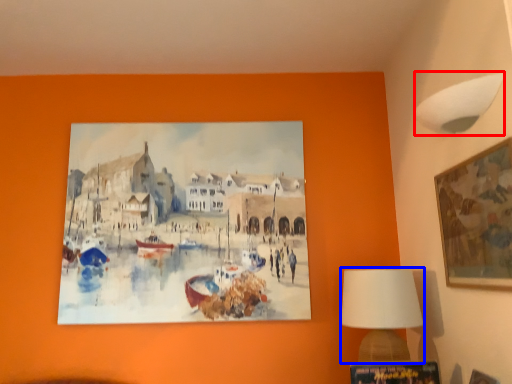
Question: Which object appears closest to the camera in this image, lamp (highlighted by a red box) or table lamp (highlighted by a blue box)?

Choices:
 (A) lamp
 (B) table lamp

Answer: (A)